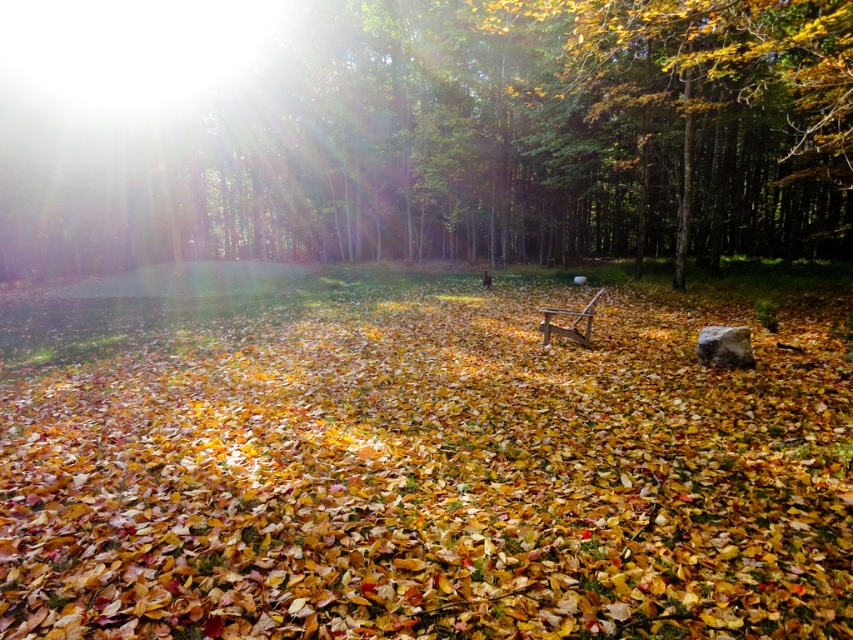
Question: Does green matte tree at center lie in front of wooden bench at center?

Choices:
 (A) yes
 (B) no

Answer: (A)

Question: Which point is farther from the camera taking this photo?

Choices:
 (A) (427, 42)
 (B) (566, 314)
 (C) (433, 392)

Answer: (A)

Question: Is multicolored leaf litter at center further to camera compared to green matte tree at center?

Choices:
 (A) no
 (B) yes

Answer: (A)

Question: Considering the relative positions of multicolored leaf litter at center and wooden bench at center in the image provided, where is multicolored leaf litter at center located with respect to wooden bench at center?

Choices:
 (A) above
 (B) below

Answer: (B)

Question: Which of these objects is positioned farthest from the green matte tree at center?

Choices:
 (A) multicolored leaf litter at center
 (B) wooden bench at center

Answer: (B)

Question: Which point is closer to the camera?

Choices:
 (A) multicolored leaf litter at center
 (B) wooden bench at center

Answer: (A)